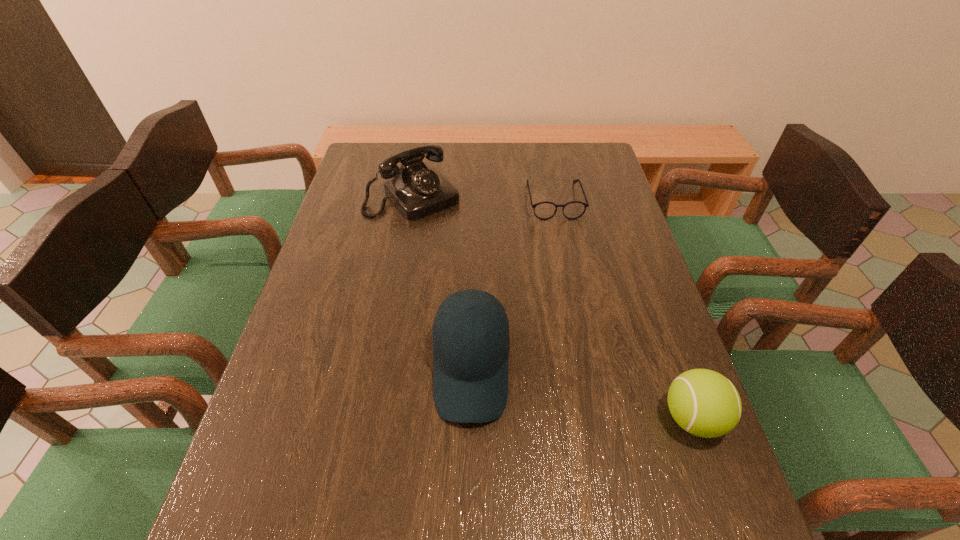
At what (x,y) coordinates should I click in order to perform the action: click on vacant space located 0.280m on the front-facing side of the shortest object. Please return your answer as a coordinate pair (x, y). Image resolution: width=960 pixels, height=540 pixels. Looking at the image, I should click on pyautogui.click(x=574, y=288).

I want to click on free point located on the dial of the telephone, so click(504, 293).

Identify the location of vacant space located on the dial of the telephone. The width and height of the screenshot is (960, 540). (455, 239).

Identify the location of free region located on the dial of the telephone. pyautogui.click(x=479, y=265).

Locate an element on the screen. Image resolution: width=960 pixels, height=540 pixels. object at the far edge is located at coordinates (417, 190).

Locate an element on the screen. The height and width of the screenshot is (540, 960). object at the near edge is located at coordinates tap(705, 403).

You are a GUI agent. You are given a task and a screenshot of the screen. Output one action in this format:
    pyautogui.click(x=<x>, y=<y>)
    Task: Click on the object at the left edge
    
    Given the screenshot: What is the action you would take?
    pyautogui.click(x=417, y=190)

Where is `tennis ball located in the right edge section of the desktop`? This screenshot has width=960, height=540. tennis ball located in the right edge section of the desktop is located at coordinates 705,403.

Image resolution: width=960 pixels, height=540 pixels. What are the coordinates of `spectacles present at the right edge` in the screenshot? It's located at (545, 210).

Where is `object at the far left corner`? This screenshot has width=960, height=540. object at the far left corner is located at coordinates (417, 190).